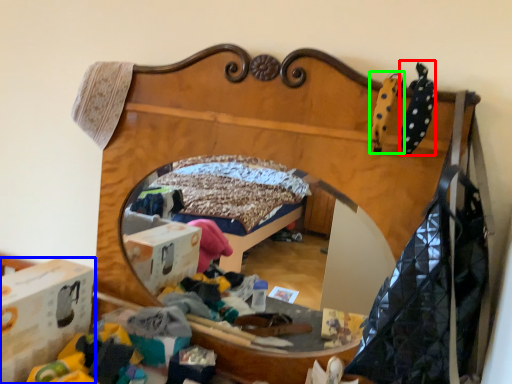
Question: Estimate the real-world distances between objects in this image. Which object is closer to clothing (highlighted by a red box), cardboard box (highlighted by a blue box) or toy (highlighted by a green box)?

Choices:
 (A) cardboard box
 (B) toy

Answer: (B)